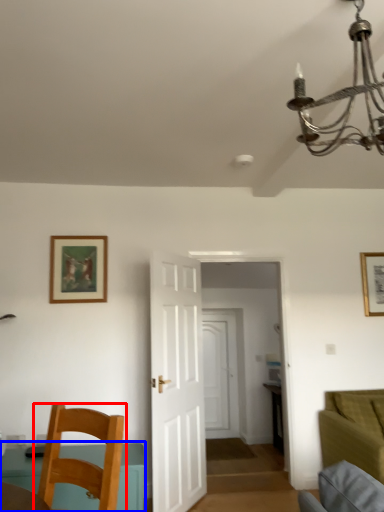
Question: Which object appears closest to the camera in this image, chair (highlighted by a red box) or table (highlighted by a blue box)?

Choices:
 (A) chair
 (B) table

Answer: (A)